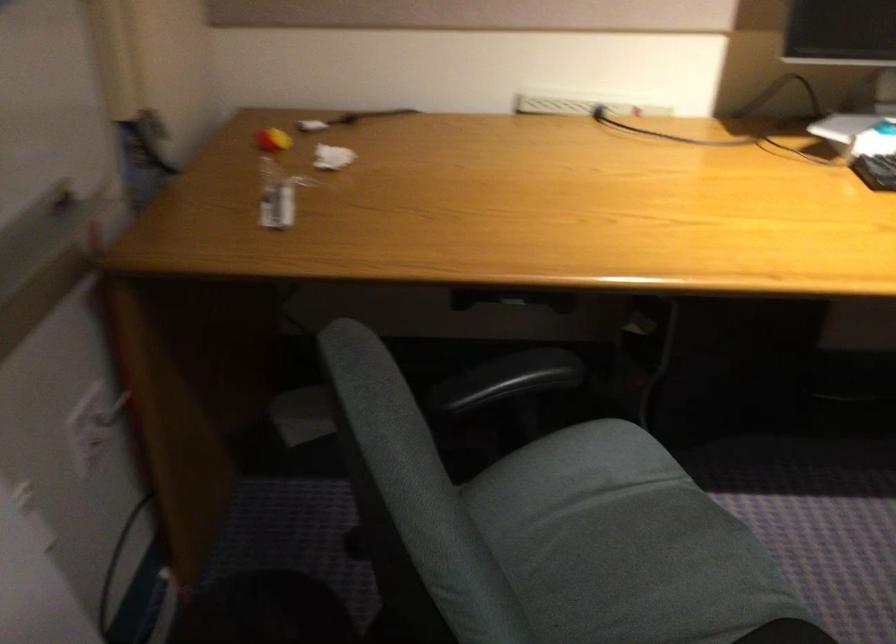
This screenshot has height=644, width=896. Describe the element at coordinates (506, 379) in the screenshot. I see `a black chair armrest` at that location.